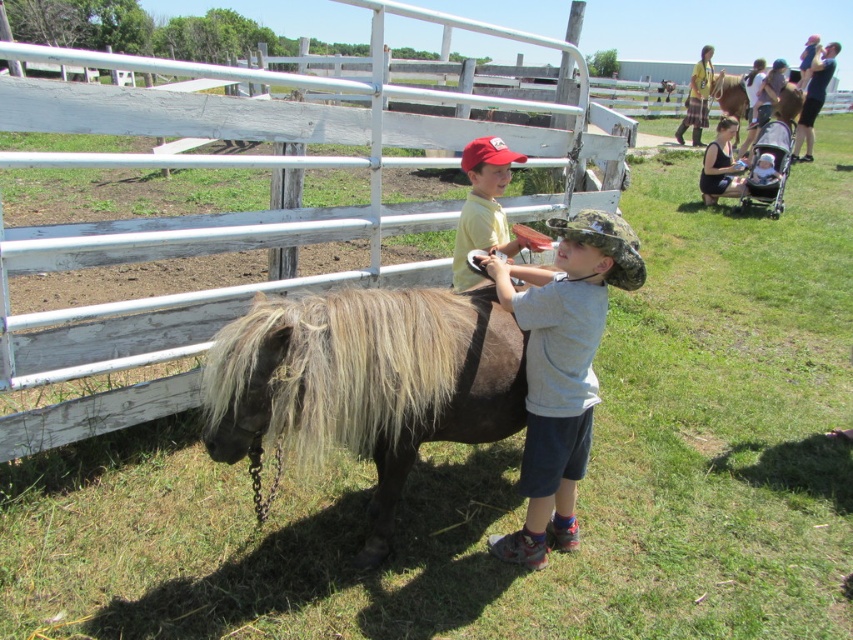
Consider the image. You are a parent trying to ensure your child stays within the designated area. Based on the scene, can the white wooden fence at center be seen over by the child wearing the camouflage fabric hat at center?

The white wooden fence at center has a lesser height compared to the camouflage fabric hat at center, so the child can see over the fence.

You are standing at the point labeled as point [250,211] in the image. What structure are you touching?

The point [250,211] is on the white wooden fence at center, so you are touching the white wooden fence at center.